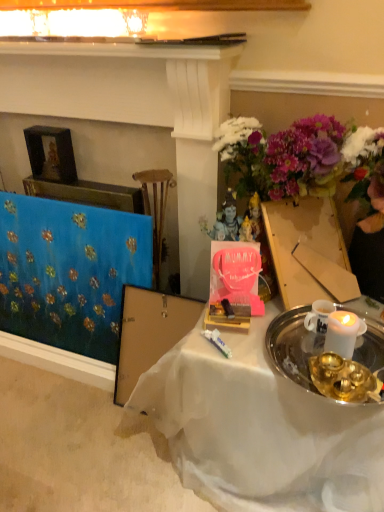
Question: Is blue fabric at left turned away from white sheer cloth at center?

Choices:
 (A) yes
 (B) no

Answer: (B)

Question: Does blue fabric at left come behind white sheer cloth at center?

Choices:
 (A) yes
 (B) no

Answer: (A)

Question: Is blue fabric at left taller than white sheer cloth at center?

Choices:
 (A) yes
 (B) no

Answer: (A)

Question: Can you confirm if blue fabric at left is thinner than white sheer cloth at center?

Choices:
 (A) no
 (B) yes

Answer: (B)

Question: From a real-world perspective, is blue fabric at left physically below white sheer cloth at center?

Choices:
 (A) no
 (B) yes

Answer: (A)

Question: Looking at the image, does blue fabric at left seem bigger or smaller compared to blue fabric at left?

Choices:
 (A) small
 (B) big

Answer: (B)

Question: Considering the positions of blue fabric at left and blue fabric at left in the image, is blue fabric at left wider or thinner than blue fabric at left?

Choices:
 (A) thin
 (B) wide

Answer: (B)

Question: Visually, is blue fabric at left positioned to the left or to the right of blue fabric at left?

Choices:
 (A) right
 (B) left

Answer: (B)

Question: Considering the positions of blue fabric at left and blue fabric at left in the image, is blue fabric at left taller or shorter than blue fabric at left?

Choices:
 (A) tall
 (B) short

Answer: (A)

Question: From the image's perspective, relative to blue fabric at left, is white sheer cloth at center above or below?

Choices:
 (A) below
 (B) above

Answer: (A)

Question: Is point (238, 385) positioned closer to the camera than point (72, 252)?

Choices:
 (A) closer
 (B) farther

Answer: (A)

Question: In the image, is white sheer cloth at center on the left side or the right side of blue fabric at left?

Choices:
 (A) right
 (B) left

Answer: (A)

Question: Considering the positions of white sheer cloth at center and blue fabric at left in the image, is white sheer cloth at center bigger or smaller than blue fabric at left?

Choices:
 (A) big
 (B) small

Answer: (A)

Question: Looking at the image, does blue fabric at left seem bigger or smaller compared to white sheer cloth at center?

Choices:
 (A) big
 (B) small

Answer: (A)

Question: Is point (8, 76) closer or farther from the camera than point (273, 386)?

Choices:
 (A) farther
 (B) closer

Answer: (A)